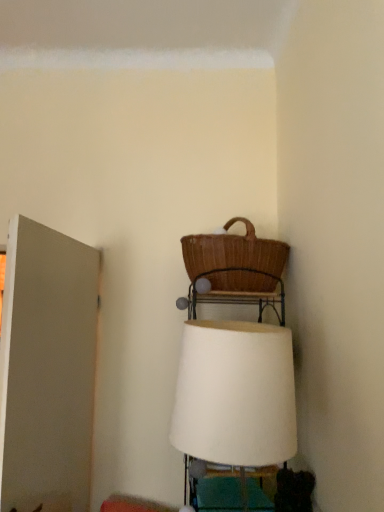
Question: Does white fabric lampshade at center lie in front of white matte door at left?

Choices:
 (A) yes
 (B) no

Answer: (A)

Question: From a real-world perspective, is white fabric lampshade at center physically below white matte door at left?

Choices:
 (A) yes
 (B) no

Answer: (A)

Question: Is white fabric lampshade at center taller than white matte door at left?

Choices:
 (A) yes
 (B) no

Answer: (B)

Question: From a real-world perspective, does white fabric lampshade at center stand above white matte door at left?

Choices:
 (A) no
 (B) yes

Answer: (A)

Question: Is white fabric lampshade at center at the left side of white matte door at left?

Choices:
 (A) yes
 (B) no

Answer: (B)

Question: Looking at their shapes, would you say brown wicker picnic basket at upper center is wider or thinner than white matte door at left?

Choices:
 (A) wide
 (B) thin

Answer: (A)

Question: From a real-world perspective, is brown wicker picnic basket at upper center positioned above or below white matte door at left?

Choices:
 (A) above
 (B) below

Answer: (A)

Question: In terms of height, does brown wicker picnic basket at upper center look taller or shorter compared to white matte door at left?

Choices:
 (A) short
 (B) tall

Answer: (A)

Question: Considering their positions, is brown wicker picnic basket at upper center located in front of or behind white matte door at left?

Choices:
 (A) front
 (B) behind

Answer: (B)

Question: Is point (233, 288) positioned closer to the camera than point (200, 418)?

Choices:
 (A) farther
 (B) closer

Answer: (A)

Question: Considering their positions, is brown wicker picnic basket at upper center located in front of or behind white fabric lampshade at center?

Choices:
 (A) behind
 (B) front

Answer: (A)

Question: In the image, is brown wicker picnic basket at upper center on the left side or the right side of white fabric lampshade at center?

Choices:
 (A) left
 (B) right

Answer: (B)

Question: From a real-world perspective, is brown wicker picnic basket at upper center physically located above or below white fabric lampshade at center?

Choices:
 (A) below
 (B) above

Answer: (B)

Question: In terms of size, does white fabric lampshade at center appear bigger or smaller than brown wicker picnic basket at upper center?

Choices:
 (A) big
 (B) small

Answer: (A)

Question: Considering the relative positions of white fabric lampshade at center and brown wicker picnic basket at upper center in the image provided, is white fabric lampshade at center to the left or to the right of brown wicker picnic basket at upper center?

Choices:
 (A) left
 (B) right

Answer: (A)